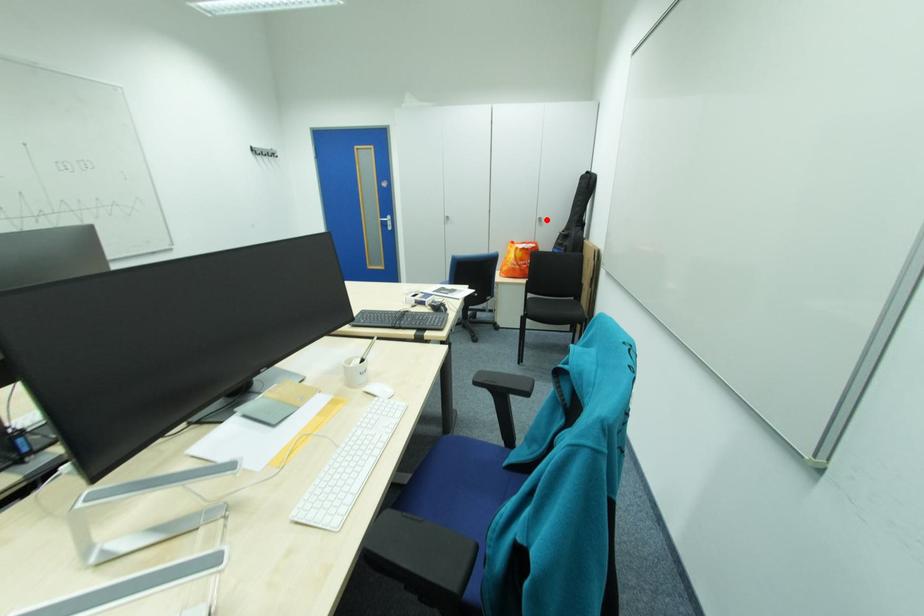
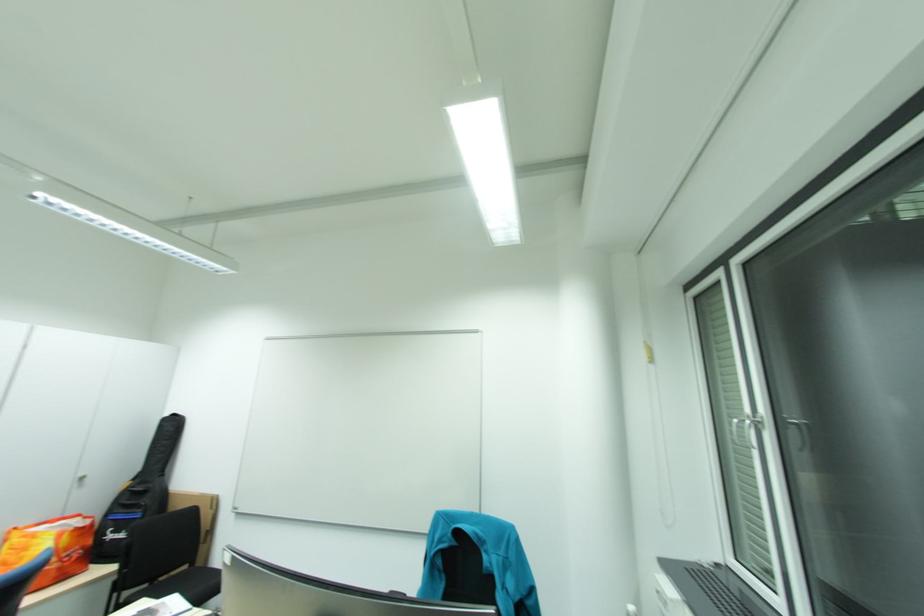
Find the pixel in the second image that matches the highlighted location in the first image.

(86, 480)